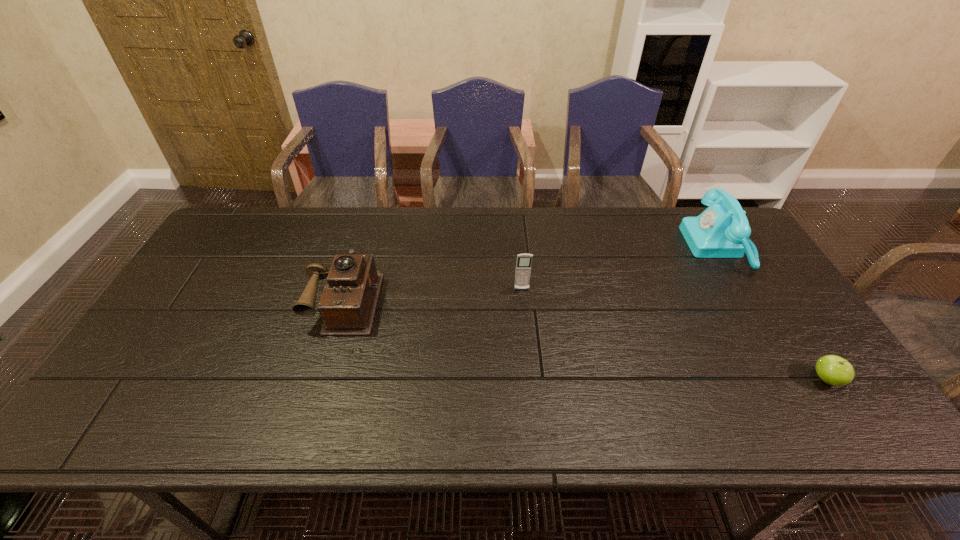
Find the location of a particular element. This screenshot has height=540, width=960. telephone is located at coordinates (722, 230).

Where is `cellular telephone`? The width and height of the screenshot is (960, 540). cellular telephone is located at coordinates (523, 266).

Where is `the leftmost object`? The image size is (960, 540). the leftmost object is located at coordinates (347, 306).

Identify the location of apple. This screenshot has height=540, width=960. (833, 370).

Find the location of a particular element. This screenshot has height=540, width=960. the nearest object is located at coordinates (833, 370).

I want to click on blank space located on the dial of the telephone, so click(619, 246).

The width and height of the screenshot is (960, 540). In order to click on blank space located 0.330m on the dial of the telephone in this screenshot , I will do `click(586, 246)`.

The image size is (960, 540). I want to click on free space located 0.290m on the dial of the telephone, so click(598, 246).

The image size is (960, 540). What are the coordinates of `free space located 0.360m on the front-facing side of the cellular telephone` in the screenshot? It's located at (533, 405).

Image resolution: width=960 pixels, height=540 pixels. In order to click on free space located 0.210m on the horn of the phonograph_record in this screenshot , I will do `click(314, 409)`.